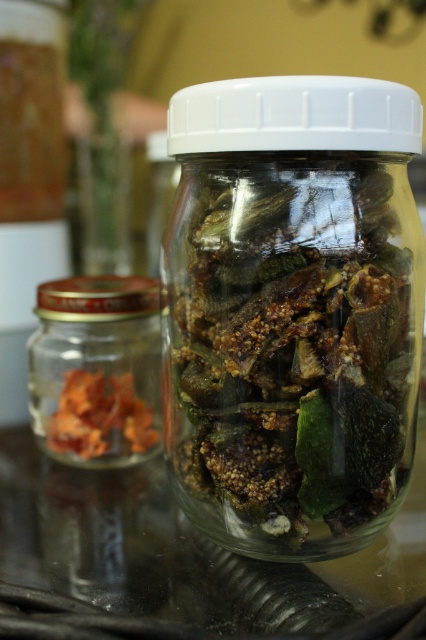
Question: Can you confirm if brown matte dried figs at center is positioned below translucent glass jar at left?

Choices:
 (A) no
 (B) yes

Answer: (A)

Question: Which of the following is the closest to the observer?

Choices:
 (A) (347, 189)
 (B) (98, 289)
 (C) (66, 424)

Answer: (A)

Question: Which point is closer to the camera?

Choices:
 (A) (155, 444)
 (B) (180, 368)
 (C) (138, 449)

Answer: (B)

Question: Is brown matte dried figs at center to the left of orange dried leaves at left from the viewer's perspective?

Choices:
 (A) no
 (B) yes

Answer: (A)

Question: Can you confirm if brown matte dried figs at center is smaller than orange dried leaves at left?

Choices:
 (A) yes
 (B) no

Answer: (B)

Question: Which of the following is the closest to the observer?

Choices:
 (A) (74, 387)
 (B) (95, 387)
 (C) (253, 323)

Answer: (C)